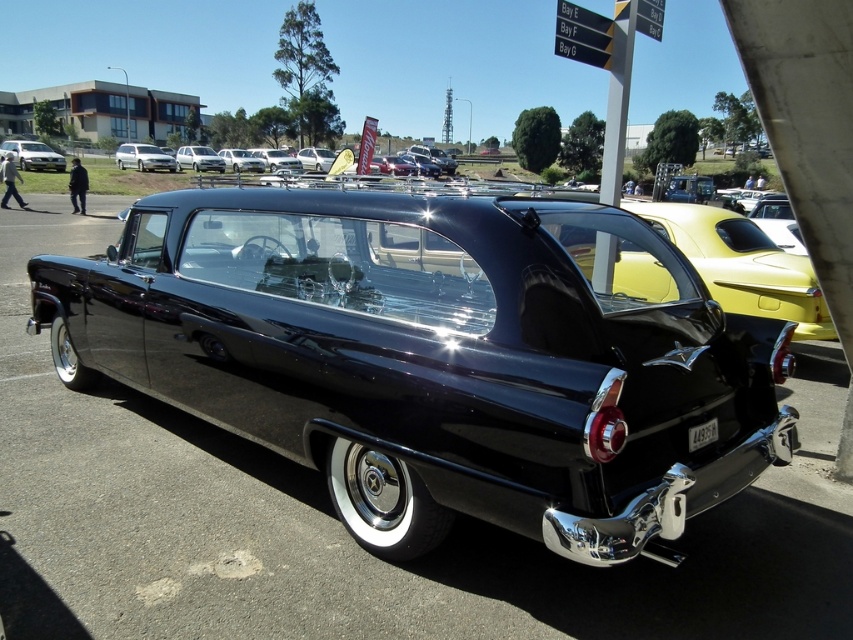
Question: Can you confirm if matte white car at upper left is wider than shiny silver sedan at center?

Choices:
 (A) no
 (B) yes

Answer: (B)

Question: Among these points, which one is farthest from the camera?

Choices:
 (A) (186, 147)
 (B) (45, 145)
 (C) (136, 150)
 (D) (734, 308)

Answer: (B)

Question: Observing the image, what is the correct spatial positioning of glossy black sedan at center in reference to shiny silver sedan at center?

Choices:
 (A) right
 (B) left

Answer: (A)

Question: Which point is closer to the camera taking this photo?

Choices:
 (A) (216, 170)
 (B) (48, 160)
 (C) (160, 154)

Answer: (B)

Question: Considering the relative positions of glossy black sedan at center and matte white car at upper left in the image provided, where is glossy black sedan at center located with respect to matte white car at upper left?

Choices:
 (A) left
 (B) right

Answer: (B)

Question: Which point appears closest to the camera in this image?

Choices:
 (A) (196, 166)
 (B) (16, 161)

Answer: (B)